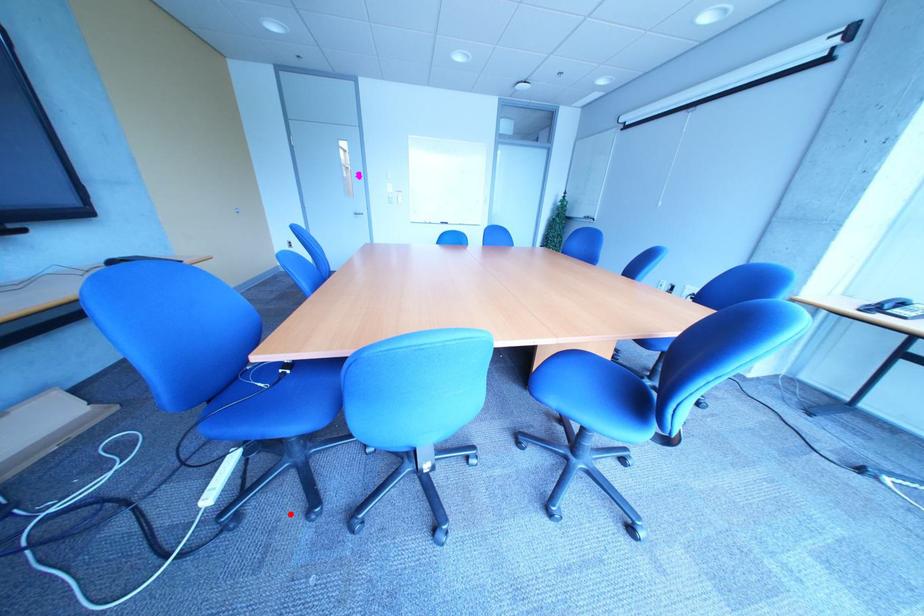
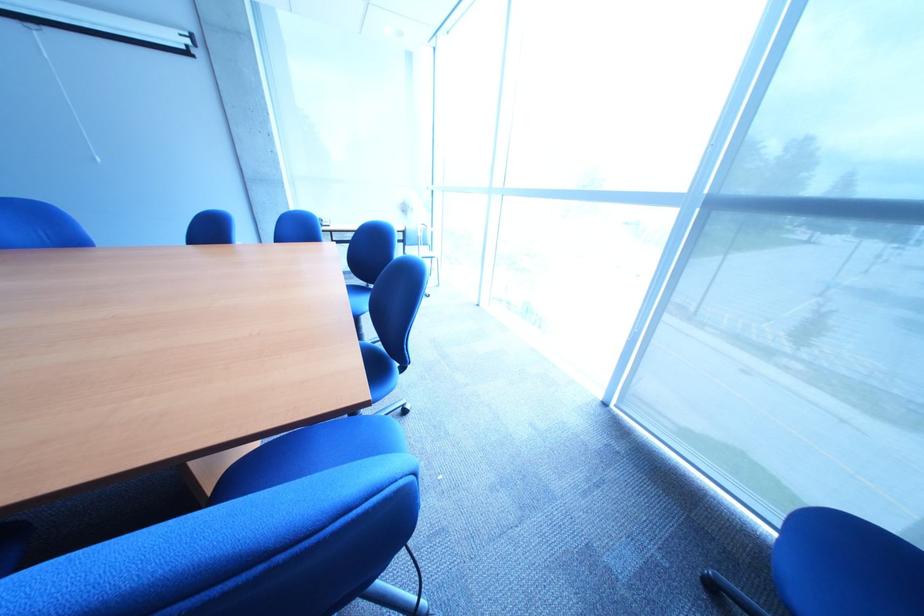
Locate, in the second image, the point that corresponds to the highlighted location in the first image.

(419, 567)